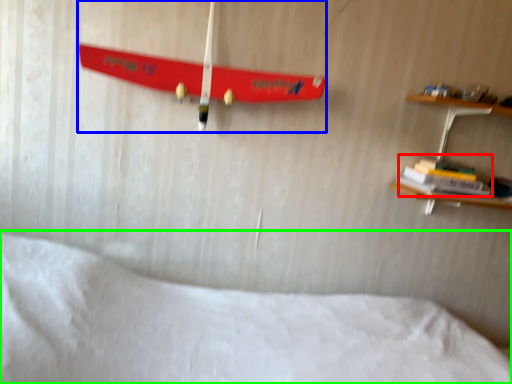
Question: Estimate the real-world distances between objects in this image. Which object is closer to book (highlighted by a red box), skateboard (highlighted by a blue box) or bed (highlighted by a green box)?

Choices:
 (A) skateboard
 (B) bed

Answer: (A)